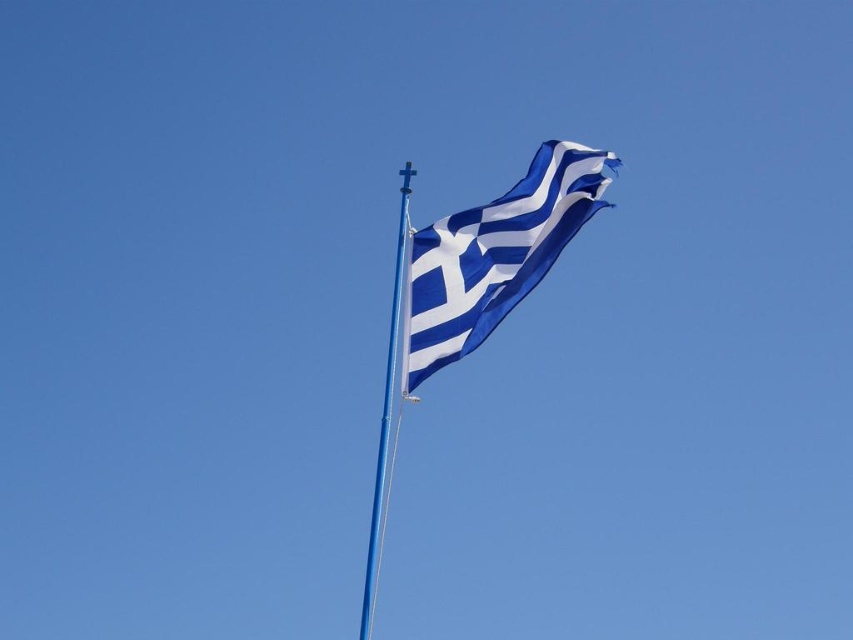
Question: Is blue/white striped flag at center bigger than smooth metal pole at center?

Choices:
 (A) yes
 (B) no

Answer: (B)

Question: Can you confirm if blue/white striped flag at center is smaller than smooth metal pole at center?

Choices:
 (A) yes
 (B) no

Answer: (A)

Question: Which object appears farthest from the camera in this image?

Choices:
 (A) blue/white striped flag at center
 (B) smooth metal pole at center

Answer: (A)

Question: Can you confirm if blue/white striped flag at center is positioned to the left of smooth metal pole at center?

Choices:
 (A) no
 (B) yes

Answer: (A)